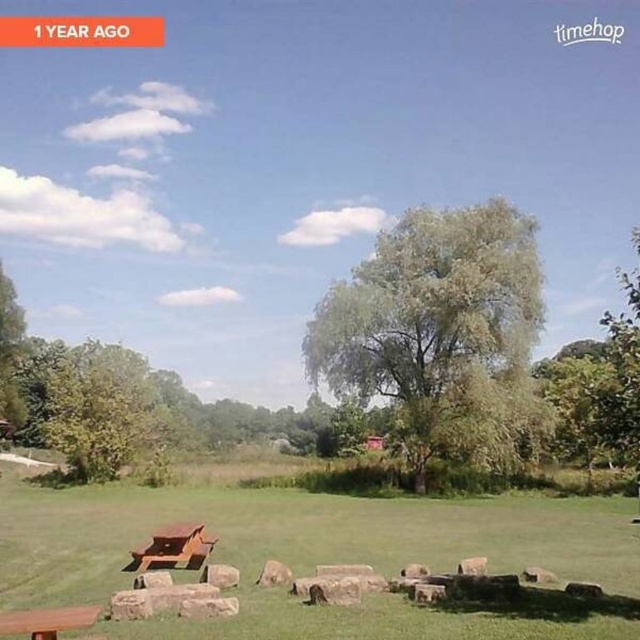
Can you confirm if wooden park bench at lower left is positioned to the left of smooth gray rock at center?

Indeed, wooden park bench at lower left is positioned on the left side of smooth gray rock at center.

Who is more forward, (209, 548) or (273, 560)?

Point (273, 560) is in front.

The image size is (640, 640). What do you see at coordinates (173, 548) in the screenshot? I see `wooden park bench at lower left` at bounding box center [173, 548].

Find the location of `wooden park bench at lower left`. wooden park bench at lower left is located at coordinates (173, 548).

Is gray rough stone at center below smooth gray rock at center?

Incorrect, gray rough stone at center is not positioned below smooth gray rock at center.

Does gray rough stone at center have a smaller size compared to smooth gray rock at center?

Incorrect, gray rough stone at center is not smaller in size than smooth gray rock at center.

Locate an element on the screen. gray rough stone at center is located at coordinates (220, 576).

Locate an element on the screen. The height and width of the screenshot is (640, 640). gray rough stone at center is located at coordinates (220, 576).

Between wooden park bench at lower left and gray rough stone at center, which one appears on the left side from the viewer's perspective?

Positioned to the left is wooden park bench at lower left.

This screenshot has height=640, width=640. What are the coordinates of `wooden park bench at lower left` in the screenshot? It's located at (173, 548).

Where is `wooden park bench at lower left`? Image resolution: width=640 pixels, height=640 pixels. wooden park bench at lower left is located at coordinates tap(173, 548).

The image size is (640, 640). In order to click on wooden park bench at lower left in this screenshot , I will do `click(173, 548)`.